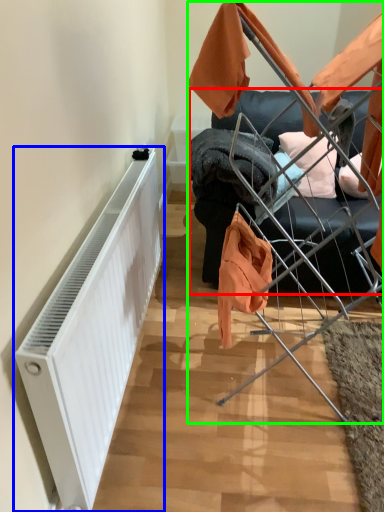
Question: Estimate the real-world distances between objects in this image. Which object is closer to furniture (highlighted by a red box), radiator (highlighted by a blue box) or baby carriage (highlighted by a green box)?

Choices:
 (A) radiator
 (B) baby carriage

Answer: (B)